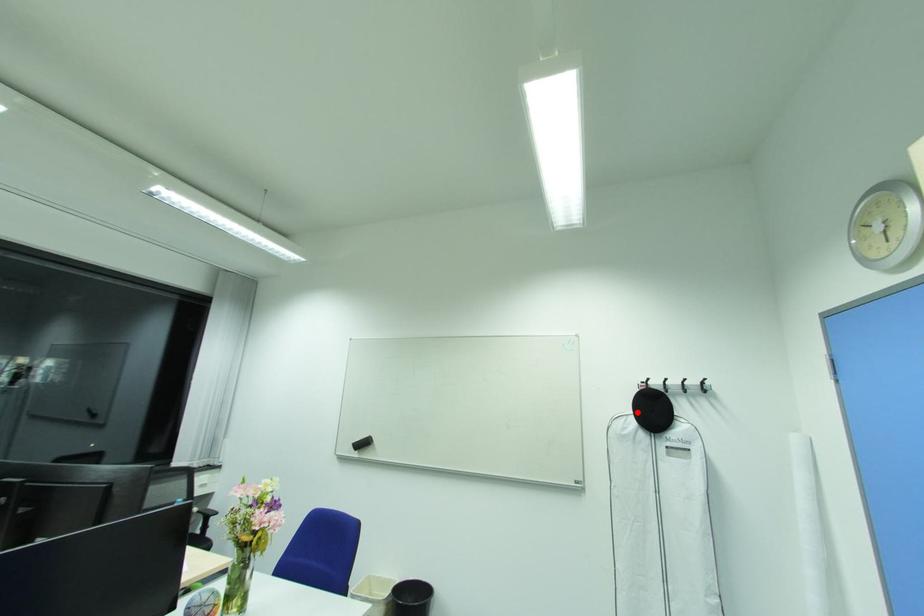
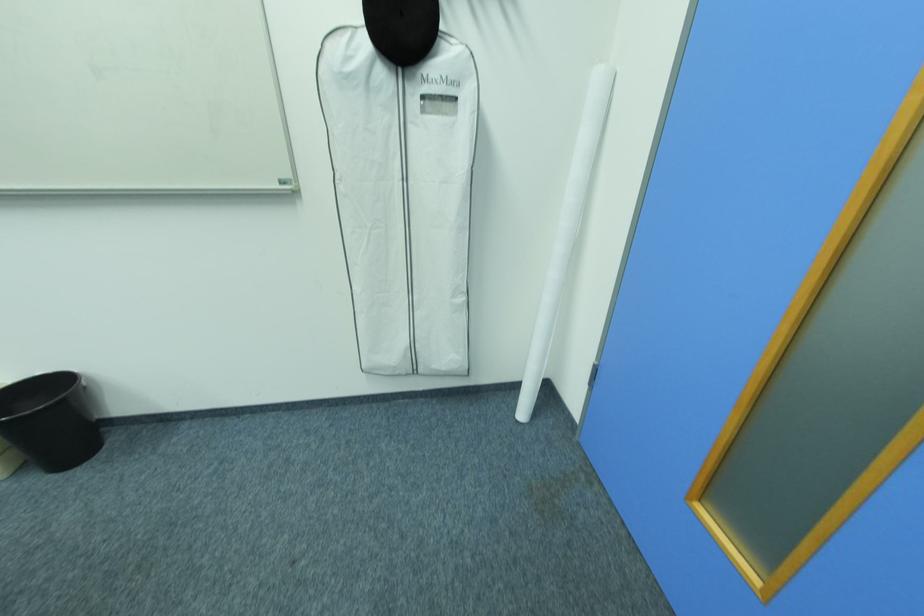
Where in the second image is the point corresponding to the highlighted location from the first image?

(368, 23)